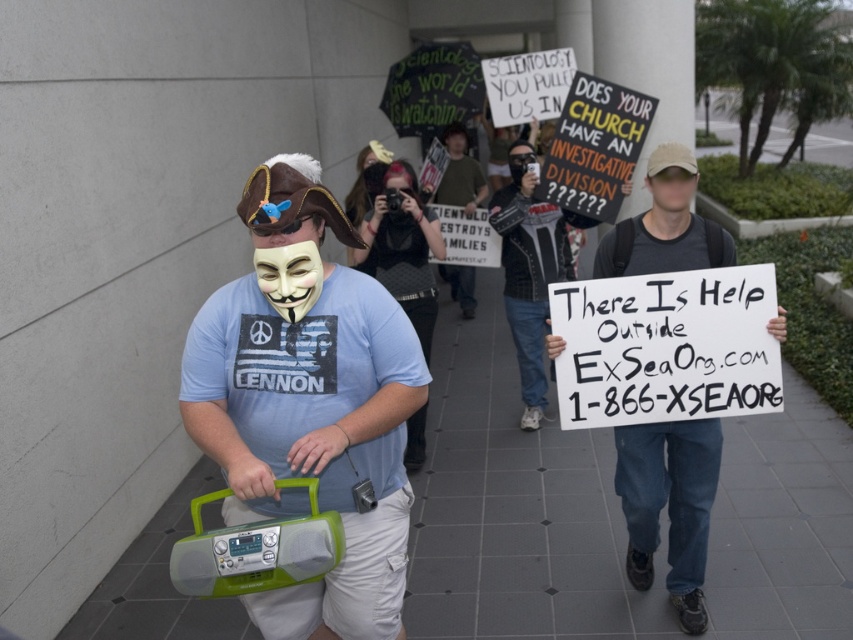
Does green plastic boombox at center come behind white paper sign at center?

No, it is in front of white paper sign at center.

Image resolution: width=853 pixels, height=640 pixels. What do you see at coordinates (309, 403) in the screenshot? I see `green plastic boombox at center` at bounding box center [309, 403].

This screenshot has width=853, height=640. Identify the location of green plastic boombox at center. (309, 403).